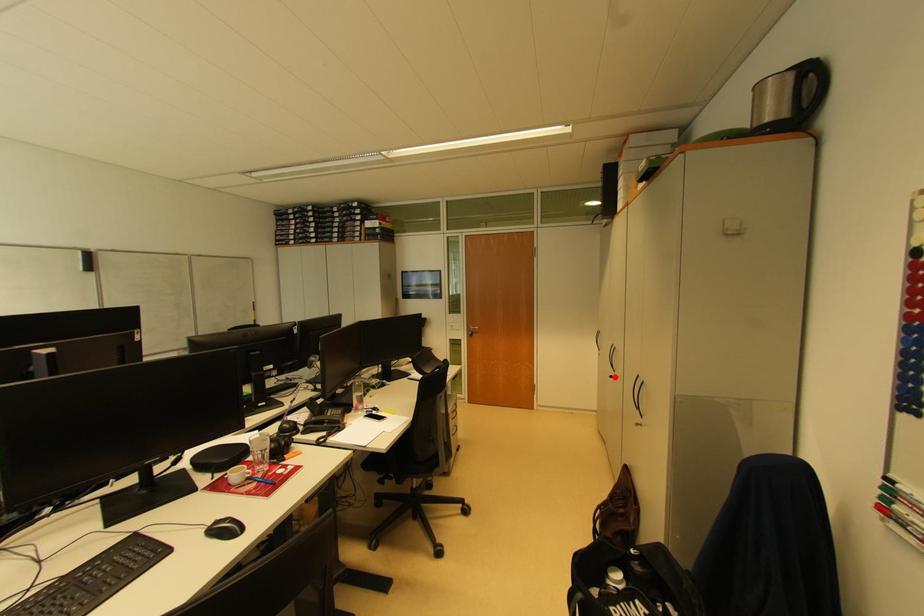
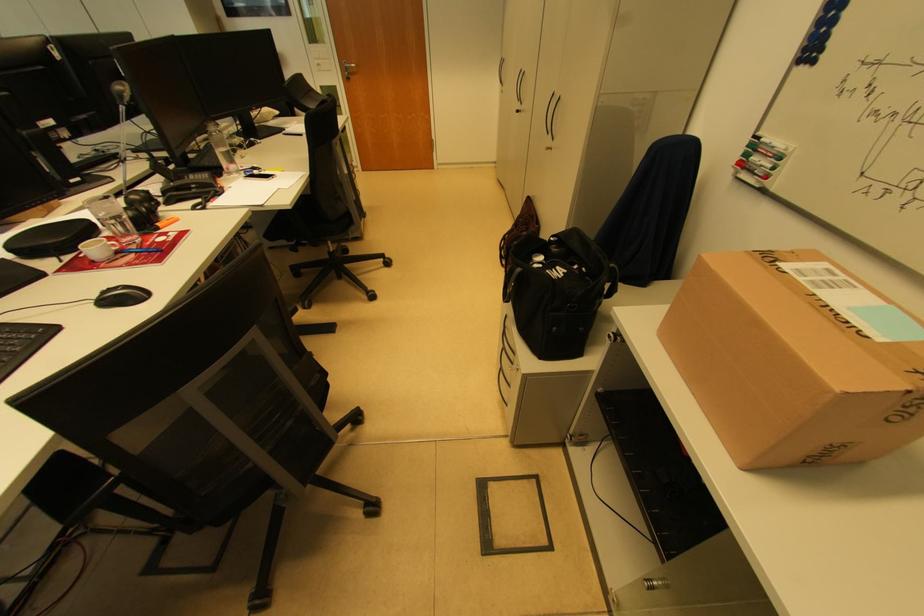
In the second image, find the point that corresponds to the highlighted location in the first image.

(520, 110)